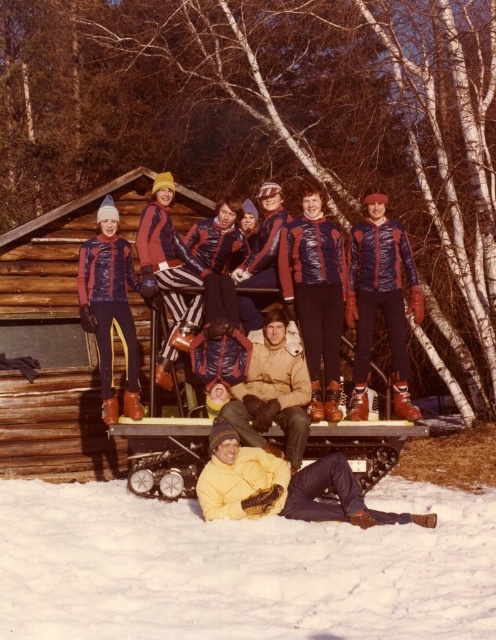
Who is positioned more to the right, white fluffy snow at lower center or yellow matte jacket at lower center?

white fluffy snow at lower center

Which is above, white fluffy snow at lower center or yellow matte jacket at lower center?

yellow matte jacket at lower center is higher up.

Image resolution: width=496 pixels, height=640 pixels. What are the coordinates of `white fluffy snow at lower center` in the screenshot? It's located at (241, 566).

Is yellow matte jacket at lower center closer to camera compared to matte blue ski suit at left?

Yes, yellow matte jacket at lower center is closer to the viewer.

Which is behind, point (418, 522) or point (121, 244)?

Positioned behind is point (121, 244).

Does point (307, 484) come behind point (138, 385)?

That is False.

Image resolution: width=496 pixels, height=640 pixels. In order to click on yellow matte jacket at lower center in this screenshot , I will do (284, 486).

Does white fluffy snow at lower center lie behind tan suede jacket at center?

That is False.

Is white fluffy snow at lower center positioned in front of tan suede jacket at center?

That is True.

Between point (170, 609) and point (285, 376), which one is positioned in front?

Point (170, 609) is more forward.

Locate an element on the screen. The width and height of the screenshot is (496, 640). white fluffy snow at lower center is located at coordinates (241, 566).